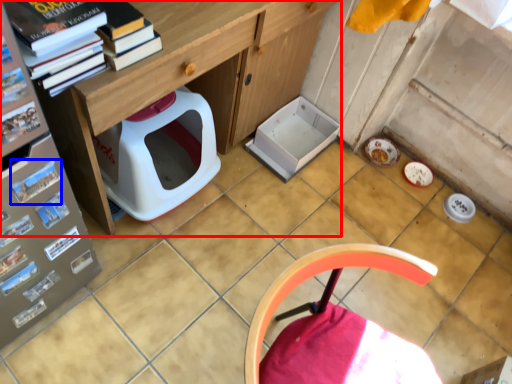
Question: Among these objects, which one is nearest to the camera, desk (highlighted by a red box) or paperback book (highlighted by a blue box)?

Choices:
 (A) desk
 (B) paperback book

Answer: (B)